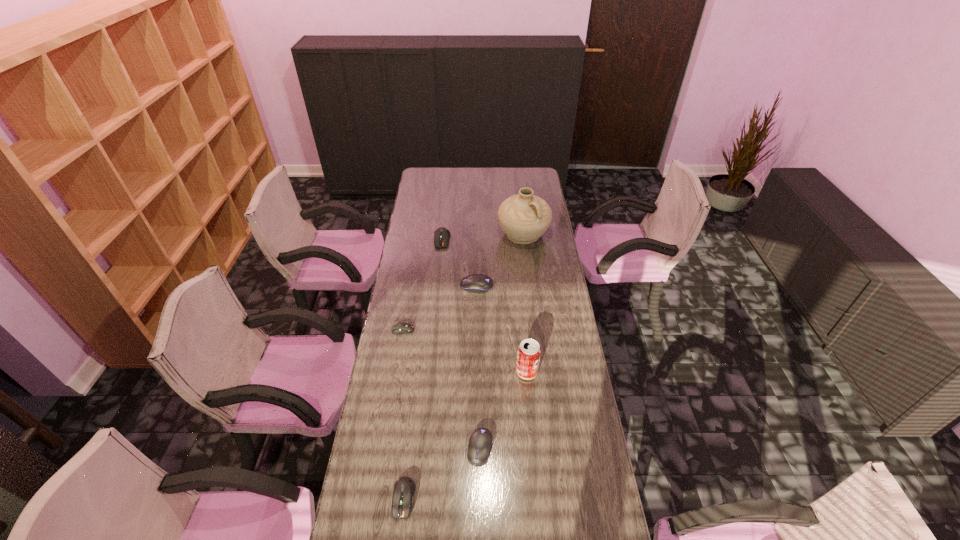
Find the location of a particular element. The image size is (960, 540). soda can that is positioned at the right edge is located at coordinates point(529,352).

Identify the location of free spot at the left edge of the desktop. (380, 462).

Where is `vacant point at the right edge`? Image resolution: width=960 pixels, height=540 pixels. vacant point at the right edge is located at coordinates click(x=580, y=429).

Where is `vacant area that lies between the fourth farthest computer equipment and the bigger black computer mouse`? The image size is (960, 540). vacant area that lies between the fourth farthest computer equipment and the bigger black computer mouse is located at coordinates (478, 367).

At what (x,y) coordinates should I click in order to perform the action: click on empty space that is in between the third nearest computer equipment and the fourth nearest computer equipment. Please return your answer as a coordinate pair (x, y). Looking at the image, I should click on (440, 308).

This screenshot has height=540, width=960. What are the coordinates of `vacant point located between the red soda can and the leftmost object` in the screenshot? It's located at (465, 351).

Locate an element on the screen. The image size is (960, 540). free space between the nearest object and the tallest object is located at coordinates (464, 366).

Identify the location of free space between the second nearest object and the red soda can. (503, 410).

Where is `vacant area between the second smallest dark computer equipment and the pottery`? vacant area between the second smallest dark computer equipment and the pottery is located at coordinates click(x=464, y=366).

Locate an element on the screen. The image size is (960, 540). free area in between the leftmost object and the nearest object is located at coordinates (403, 414).